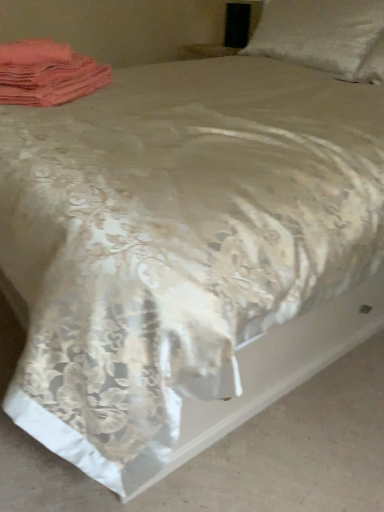
Question: Considering the relative sizes of silky beige bedspread at center and satin white pillow at upper right in the image provided, is silky beige bedspread at center shorter than satin white pillow at upper right?

Choices:
 (A) yes
 (B) no

Answer: (A)

Question: Is silky beige bedspread at center oriented away from satin white pillow at upper right?

Choices:
 (A) no
 (B) yes

Answer: (A)

Question: From the image's perspective, is silky beige bedspread at center on top of satin white pillow at upper right?

Choices:
 (A) no
 (B) yes

Answer: (A)

Question: From the image's perspective, is silky beige bedspread at center under satin white pillow at upper right?

Choices:
 (A) no
 (B) yes

Answer: (B)

Question: Is silky beige bedspread at center aimed at satin white pillow at upper right?

Choices:
 (A) no
 (B) yes

Answer: (A)

Question: Considering the relative sizes of silky beige bedspread at center and satin white pillow at upper right in the image provided, is silky beige bedspread at center smaller than satin white pillow at upper right?

Choices:
 (A) no
 (B) yes

Answer: (B)

Question: Is pink fabric at upper left not close to satin white pillow at upper right?

Choices:
 (A) yes
 (B) no

Answer: (A)

Question: Does pink fabric at upper left contain satin white pillow at upper right?

Choices:
 (A) no
 (B) yes

Answer: (A)

Question: From the image's perspective, is pink fabric at upper left above satin white pillow at upper right?

Choices:
 (A) yes
 (B) no

Answer: (B)

Question: Can you confirm if pink fabric at upper left is shorter than satin white pillow at upper right?

Choices:
 (A) no
 (B) yes

Answer: (B)

Question: Is pink fabric at upper left placed right next to satin white pillow at upper right?

Choices:
 (A) no
 (B) yes

Answer: (A)

Question: Is pink fabric at upper left not inside satin white pillow at upper right?

Choices:
 (A) no
 (B) yes

Answer: (B)

Question: Is silky beige bedspread at center aimed at pink fabric at upper left?

Choices:
 (A) no
 (B) yes

Answer: (A)